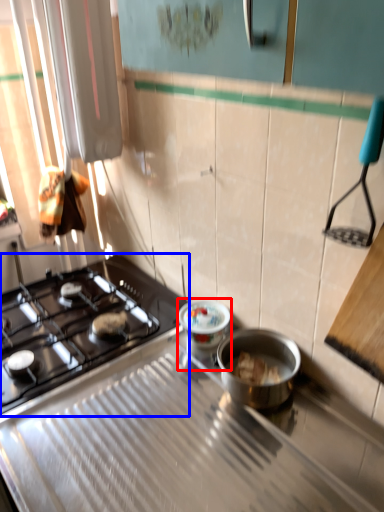
Question: Which of the following is the closest to the observer, appliance (highlighted by a red box) or gas stove (highlighted by a blue box)?

Choices:
 (A) appliance
 (B) gas stove

Answer: (B)